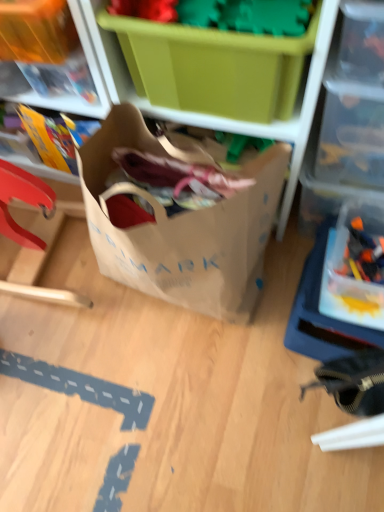
Question: Can you confirm if translucent plastic toy at right is thinner than transparent plastic container at upper right?

Choices:
 (A) yes
 (B) no

Answer: (A)

Question: From the image's perspective, is translucent plastic toy at right below transparent plastic container at upper right?

Choices:
 (A) no
 (B) yes

Answer: (B)

Question: Can you confirm if translucent plastic toy at right is positioned to the right of transparent plastic container at upper right?

Choices:
 (A) yes
 (B) no

Answer: (A)

Question: Is translucent plastic toy at right surrounding transparent plastic container at upper right?

Choices:
 (A) yes
 (B) no

Answer: (B)

Question: From a real-world perspective, is translucent plastic toy at right on top of transparent plastic container at upper right?

Choices:
 (A) yes
 (B) no

Answer: (B)

Question: From a real-world perspective, is translucent plastic toy at right below transparent plastic container at upper right?

Choices:
 (A) no
 (B) yes

Answer: (B)

Question: Considering the relative sizes of brown paper bag at center and matte plastic storage box at upper left, the 1th storage box when ordered from left to right, in the image provided, is brown paper bag at center bigger than matte plastic storage box at upper left, the 1th storage box when ordered from left to right,?

Choices:
 (A) yes
 (B) no

Answer: (A)

Question: Is matte plastic storage box at upper left, the 1th storage box when ordered from left to right, inside brown paper bag at center?

Choices:
 (A) no
 (B) yes

Answer: (A)

Question: Considering the relative sizes of brown paper bag at center and matte plastic storage box at upper left, which appears as the third storage box when viewed from the right, in the image provided, is brown paper bag at center taller than matte plastic storage box at upper left, which appears as the third storage box when viewed from the right,?

Choices:
 (A) yes
 (B) no

Answer: (A)

Question: Can you confirm if brown paper bag at center is smaller than matte plastic storage box at upper left, which appears as the third storage box when viewed from the right?

Choices:
 (A) yes
 (B) no

Answer: (B)

Question: Is brown paper bag at center to the left of matte plastic storage box at upper left, the 1th storage box when ordered from left to right, from the viewer's perspective?

Choices:
 (A) no
 (B) yes

Answer: (A)

Question: From the image's perspective, is brown paper bag at center under matte plastic storage box at upper left, the 1th storage box when ordered from left to right?

Choices:
 (A) no
 (B) yes

Answer: (B)

Question: Is transparent plastic storage box at right, which appears as the 3th storage box when viewed from the left, outside brown paper bag at center?

Choices:
 (A) yes
 (B) no

Answer: (A)